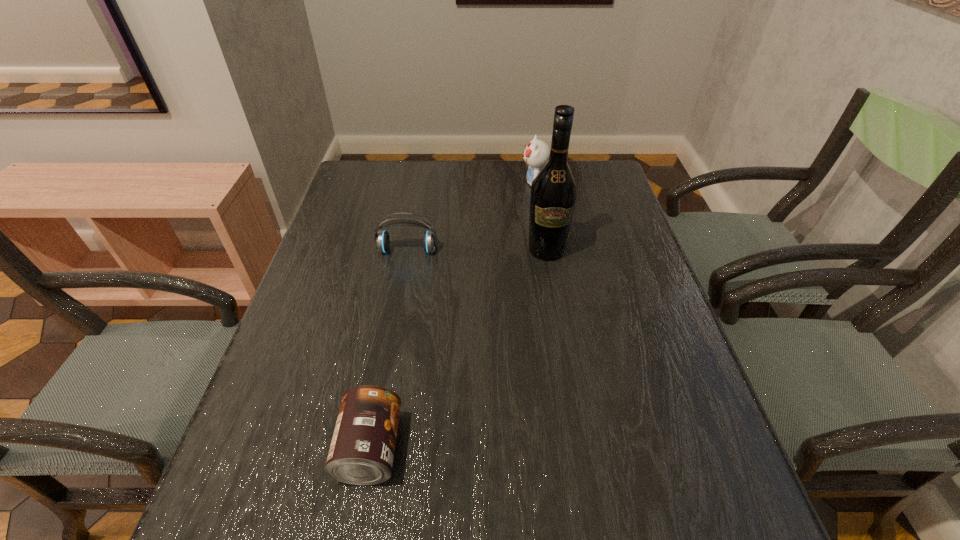
Locate an element on the screen. vacant area in the image that satisfies the following two spatial constraints: 1. on the label of the tallest object; 2. on the front label of the can is located at coordinates (579, 449).

At what (x,y) coordinates should I click in order to perform the action: click on free point that satisfies the following two spatial constraints: 1. on the front-facing side of the third shortest object; 2. on the ear cups of the headset. Please return your answer as a coordinate pair (x, y). Looking at the image, I should click on (544, 251).

At what (x,y) coordinates should I click in order to perform the action: click on free space that satisfies the following two spatial constraints: 1. on the front-facing side of the second tallest object; 2. on the ear cups of the headset. Please return your answer as a coordinate pair (x, y). Image resolution: width=960 pixels, height=540 pixels. Looking at the image, I should click on (544, 251).

At what (x,y) coordinates should I click in order to perform the action: click on free space that satisfies the following two spatial constraints: 1. on the label of the wine bottle; 2. on the front label of the can. Please return your answer as a coordinate pair (x, y). Image resolution: width=960 pixels, height=540 pixels. Looking at the image, I should click on (579, 449).